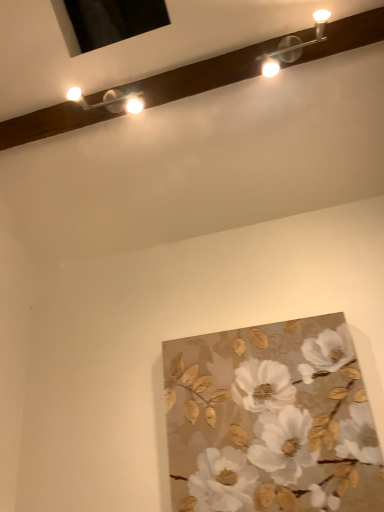
Identify the location of gold textured leaves and flowers at center. The height and width of the screenshot is (512, 384). (271, 421).

What do you see at coordinates (271, 421) in the screenshot?
I see `gold textured leaves and flowers at center` at bounding box center [271, 421].

Find the location of a particular element. The image size is (384, 512). gold textured leaves and flowers at center is located at coordinates (271, 421).